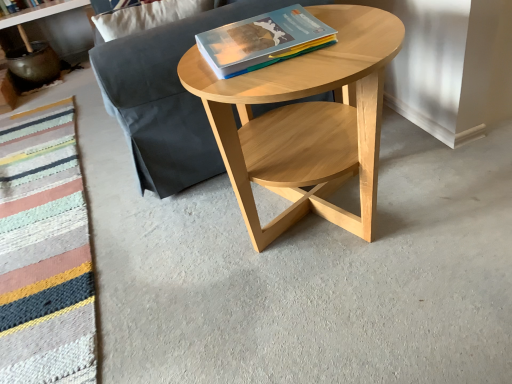
This screenshot has height=384, width=512. Identify the location of free space in front of matte paper book at center. 287,78.